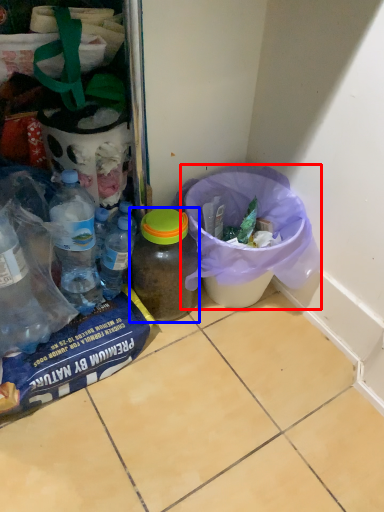
Question: Which object appears closest to the camera in this image, recycling bin (highlighted by a red box) or bottle (highlighted by a blue box)?

Choices:
 (A) recycling bin
 (B) bottle

Answer: (A)